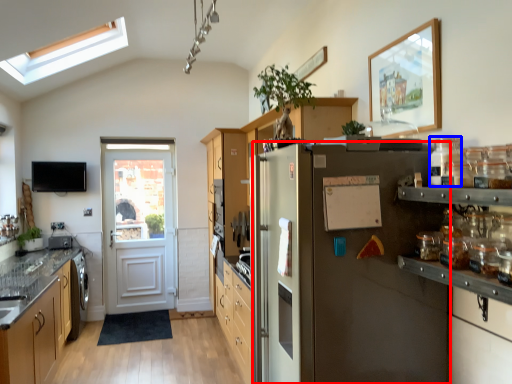
Question: Among these objects, which one is farthest to the camera, refrigerator (highlighted by a red box) or glass jar (highlighted by a blue box)?

Choices:
 (A) refrigerator
 (B) glass jar

Answer: (A)